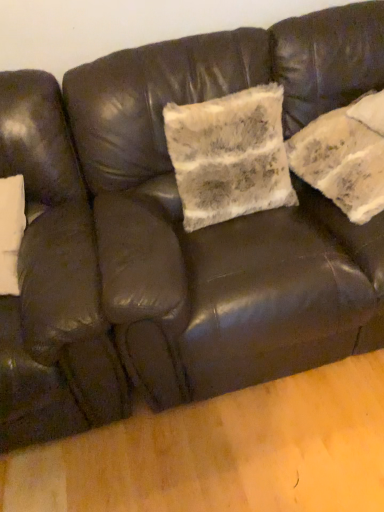
Question: In the image, is matte black armchair at left on the left side or the right side of fuzzy white pillow at center?

Choices:
 (A) left
 (B) right

Answer: (A)

Question: Relative to fuzzy white pillow at center, is matte black armchair at left in front or behind?

Choices:
 (A) behind
 (B) front

Answer: (B)

Question: Which is correct: matte black armchair at left is inside fuzzy white pillow at center, or outside of it?

Choices:
 (A) outside
 (B) inside

Answer: (A)

Question: Is fuzzy white pillow at center taller or shorter than matte black armchair at left?

Choices:
 (A) tall
 (B) short

Answer: (B)

Question: From the image's perspective, is fuzzy white pillow at center located above or below matte black armchair at left?

Choices:
 (A) above
 (B) below

Answer: (A)

Question: Is fuzzy white pillow at center bigger or smaller than matte black armchair at left?

Choices:
 (A) big
 (B) small

Answer: (B)

Question: Relative to matte black armchair at left, is fuzzy white pillow at center in front or behind?

Choices:
 (A) behind
 (B) front

Answer: (A)